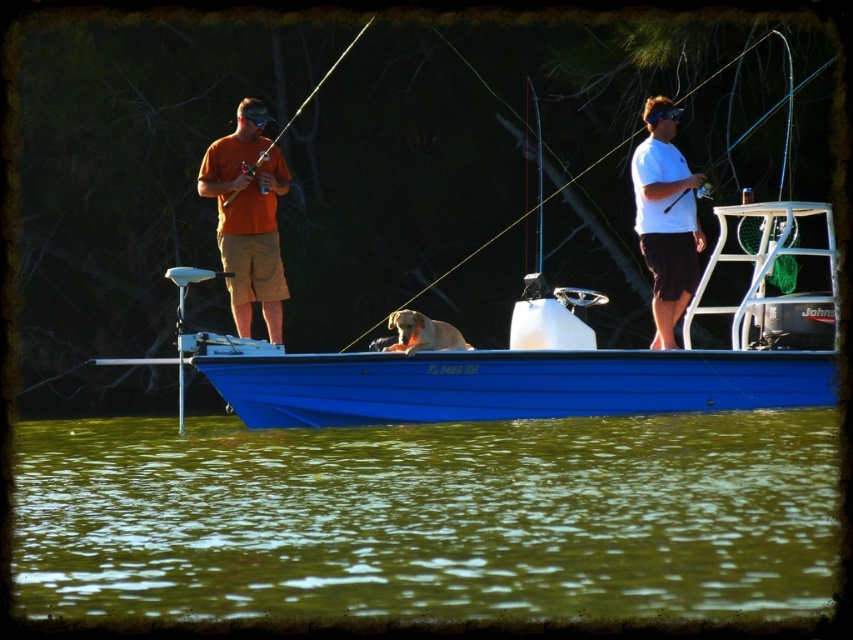
Question: Does white matte shirt at right have a larger size compared to golden fur dog at center?

Choices:
 (A) no
 (B) yes

Answer: (A)

Question: Which point is closer to the camera?

Choices:
 (A) orange cotton shirt at center
 (B) golden fur dog at center
 (C) white matte shirt at right
 (D) matte black fishing pole at left

Answer: (B)

Question: Which point is closer to the camera?

Choices:
 (A) green algae water at lower center
 (B) white matte shirt at right
 (C) golden fur dog at center

Answer: (A)

Question: Is green algae water at lower center behind matte black fishing pole at left?

Choices:
 (A) yes
 (B) no

Answer: (B)

Question: Which of the following is the closest to the observer?

Choices:
 (A) white matte shirt at right
 (B) golden fur dog at center
 (C) orange cotton shirt at center

Answer: (B)

Question: Is green algae water at lower center wider than golden fur dog at center?

Choices:
 (A) no
 (B) yes

Answer: (B)